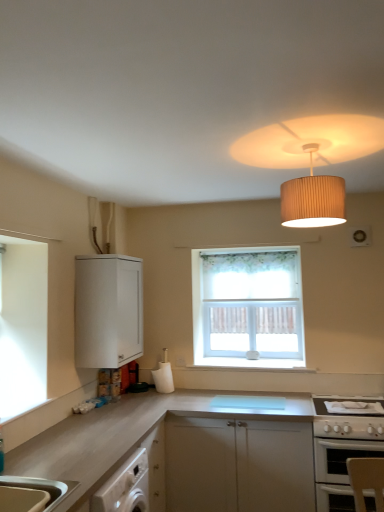
Question: Is the depth of white glossy oven at lower right greater than that of white glossy gas stove at lower right?

Choices:
 (A) yes
 (B) no

Answer: (B)

Question: Can we say white glossy oven at lower right lies outside white glossy gas stove at lower right?

Choices:
 (A) no
 (B) yes

Answer: (B)

Question: Does white glossy oven at lower right have a greater height compared to white glossy gas stove at lower right?

Choices:
 (A) no
 (B) yes

Answer: (B)

Question: Considering the relative sizes of white glossy oven at lower right and white glossy gas stove at lower right in the image provided, is white glossy oven at lower right smaller than white glossy gas stove at lower right?

Choices:
 (A) yes
 (B) no

Answer: (B)

Question: From a real-world perspective, is white glossy oven at lower right physically below white glossy gas stove at lower right?

Choices:
 (A) no
 (B) yes

Answer: (B)

Question: Is white floral curtain at center to the left or to the right of satin white countertop at center in the image?

Choices:
 (A) right
 (B) left

Answer: (A)

Question: From the image's perspective, is white floral curtain at center above or below satin white countertop at center?

Choices:
 (A) below
 (B) above

Answer: (B)

Question: Does point (246, 322) appear closer or farther from the camera than point (16, 437)?

Choices:
 (A) closer
 (B) farther

Answer: (B)

Question: From a real-world perspective, is white floral curtain at center above or below satin white countertop at center?

Choices:
 (A) below
 (B) above

Answer: (B)

Question: Would you say beige pleated lampshade at upper center is inside or outside white glossy gas stove at lower right?

Choices:
 (A) inside
 (B) outside

Answer: (B)

Question: Considering the relative positions of beige pleated lampshade at upper center and white glossy gas stove at lower right in the image provided, is beige pleated lampshade at upper center to the left or to the right of white glossy gas stove at lower right?

Choices:
 (A) right
 (B) left

Answer: (B)

Question: From their relative heights in the image, would you say beige pleated lampshade at upper center is taller or shorter than white glossy gas stove at lower right?

Choices:
 (A) tall
 (B) short

Answer: (A)

Question: Looking at the image, does beige pleated lampshade at upper center seem bigger or smaller compared to white glossy gas stove at lower right?

Choices:
 (A) big
 (B) small

Answer: (B)

Question: From their relative heights in the image, would you say satin white countertop at center is taller or shorter than beige pleated lampshade at upper center?

Choices:
 (A) short
 (B) tall

Answer: (B)

Question: Considering their positions, is satin white countertop at center located in front of or behind beige pleated lampshade at upper center?

Choices:
 (A) front
 (B) behind

Answer: (B)